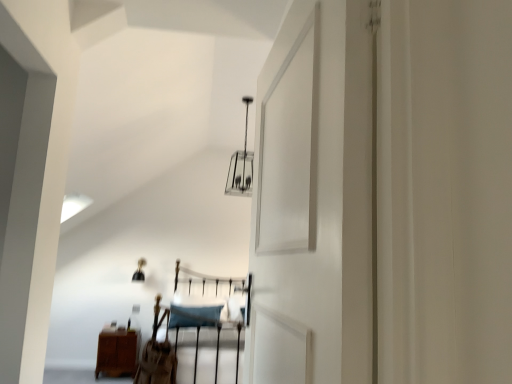
The image size is (512, 384). In order to click on metallic silver light fixture at upper center in this screenshot , I will do `click(241, 165)`.

Measure the distance between point (154, 310) and camera.

Point (154, 310) is 3.60 meters from camera.

Where is `metallic silver light fixture at upper center`? The height and width of the screenshot is (384, 512). metallic silver light fixture at upper center is located at coordinates (241, 165).

Does brown leather chair at center come behind brown wood nightstand at lower left?

No, brown leather chair at center is closer to the viewer.

Identify the location of furniture on the left of brown leather chair at center. The height and width of the screenshot is (384, 512). (117, 352).

How many degrees apart are the facing directions of brown leather chair at center and brown wood nightstand at lower left?

The angular difference between brown leather chair at center and brown wood nightstand at lower left is 5.5 degrees.

Is brown leather chair at center far from brown wood nightstand at lower left?

Yes, brown leather chair at center is far from brown wood nightstand at lower left.

Is metallic silver light fixture at upper center oriented away from brown leather chair at center?

No.

Between metallic silver light fixture at upper center and brown leather chair at center, which one appears on the right side from the viewer's perspective?

metallic silver light fixture at upper center.

From a real-world perspective, relative to brown leather chair at center, is metallic silver light fixture at upper center vertically above or below?

Clearly, from a real-world perspective, metallic silver light fixture at upper center is above brown leather chair at center.

How distant is metallic silver light fixture at upper center from brown leather chair at center?

A distance of 4.89 feet exists between metallic silver light fixture at upper center and brown leather chair at center.

Are brown wood nightstand at lower left and brown leather chair at center located far from each other?

Yes, brown wood nightstand at lower left and brown leather chair at center are quite far apart.

In the scene shown: Which of these two, brown wood nightstand at lower left or brown leather chair at center, is smaller?

Smaller between the two is brown leather chair at center.

Which point is more distant from viewer, [135,334] or [147,369]?

Point [135,334]

Which of these two, metallic silver light fixture at upper center or brown wood nightstand at lower left, is thinner?

brown wood nightstand at lower left.

From the image's perspective, relative to brown wood nightstand at lower left, is metallic silver light fixture at upper center above or below?

Based on their image positions, metallic silver light fixture at upper center is located above brown wood nightstand at lower left.

Which is farther, (243, 189) or (108, 369)?

The point (108, 369) is farther from the camera.

Is metallic silver light fixture at upper center far from brown wood nightstand at lower left?

Yes, metallic silver light fixture at upper center and brown wood nightstand at lower left are quite far apart.

Considering the sizes of objects brown wood nightstand at lower left and metallic silver light fixture at upper center in the image provided, who is bigger, brown wood nightstand at lower left or metallic silver light fixture at upper center?

Bigger between the two is metallic silver light fixture at upper center.

Are brown wood nightstand at lower left and metallic silver light fixture at upper center beside each other?

brown wood nightstand at lower left is not next to metallic silver light fixture at upper center, and they're not touching.

Is point (127, 340) farther from camera compared to point (252, 169)?

Yes.

Is brown wood nightstand at lower left looking in the opposite direction of metallic silver light fixture at upper center?

No, metallic silver light fixture at upper center is not at the back of brown wood nightstand at lower left.

Who is bigger, brown leather chair at center or metallic silver light fixture at upper center?

metallic silver light fixture at upper center.

Is brown leather chair at center positioned with its back to metallic silver light fixture at upper center?

No.

Would you say brown leather chair at center contains metallic silver light fixture at upper center?

That's incorrect, metallic silver light fixture at upper center is not inside brown leather chair at center.

From the image's perspective, which is below, brown leather chair at center or metallic silver light fixture at upper center?

From the image's view, brown leather chair at center is below.

You are a GUI agent. You are given a task and a screenshot of the screen. Output one action in this format:
    pyautogui.click(x=<x>, y=<y>)
    Task: Click on the furniture behind the brown leather chair at center
    The height and width of the screenshot is (384, 512).
    Given the screenshot: What is the action you would take?
    pyautogui.click(x=117, y=352)

Where is `chair that appears below the metallic silver light fixture at upper center (from a real-world perspective)`? This screenshot has height=384, width=512. chair that appears below the metallic silver light fixture at upper center (from a real-world perspective) is located at coordinates (157, 356).

From the image, which object appears to be farther from metallic silver light fixture at upper center, brown leather chair at center or brown wood nightstand at lower left?

brown wood nightstand at lower left is further to metallic silver light fixture at upper center.

Considering their positions, is brown leather chair at center positioned closer to brown wood nightstand at lower left than metallic silver light fixture at upper center?

The object closer to brown wood nightstand at lower left is brown leather chair at center.

Looking at the image, which one is located closer to brown leather chair at center, metallic silver light fixture at upper center or brown wood nightstand at lower left?

brown wood nightstand at lower left lies closer to brown leather chair at center than the other object.

Looking at the image, which one is located closer to brown leather chair at center, brown wood nightstand at lower left or metallic silver light fixture at upper center?

Among the two, brown wood nightstand at lower left is located nearer to brown leather chair at center.

Based on their spatial positions, is brown wood nightstand at lower left or brown leather chair at center closer to metallic silver light fixture at upper center?

brown leather chair at center is closer to metallic silver light fixture at upper center.

Estimate the real-world distances between objects in this image. Which object is further from brown wood nightstand at lower left, metallic silver light fixture at upper center or brown leather chair at center?

The object further to brown wood nightstand at lower left is metallic silver light fixture at upper center.

What are the coordinates of `chair between metallic silver light fixture at upper center and brown wood nightstand at lower left in the up-down direction` in the screenshot? It's located at (157, 356).